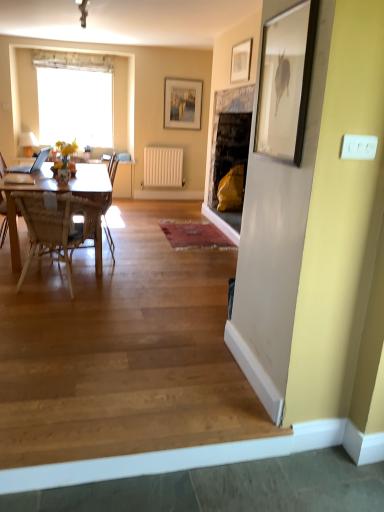
Question: Is matte glass vase at center oriented towards woven wood chair at left, positioned as the 2th chair in back-to-front order?

Choices:
 (A) no
 (B) yes

Answer: (A)

Question: Is matte glass vase at center shorter than woven wood chair at left, positioned as the 2th chair in back-to-front order?

Choices:
 (A) no
 (B) yes

Answer: (B)

Question: From the image's perspective, is matte glass vase at center on top of woven wood chair at left, marked as the 1th chair in a front-to-back arrangement?

Choices:
 (A) yes
 (B) no

Answer: (A)

Question: From a real-world perspective, is matte glass vase at center beneath woven wood chair at left, marked as the 1th chair in a front-to-back arrangement?

Choices:
 (A) yes
 (B) no

Answer: (B)

Question: Is woven wood chair at left, marked as the 1th chair in a front-to-back arrangement, at the back of matte glass vase at center?

Choices:
 (A) no
 (B) yes

Answer: (A)

Question: Is point (119, 205) closer or farther from the camera than point (112, 157)?

Choices:
 (A) closer
 (B) farther

Answer: (A)

Question: Is wooden at lower left situated inside wooden chair at left, which appears as the 1th chair when viewed from the back, or outside?

Choices:
 (A) inside
 (B) outside

Answer: (B)

Question: In terms of height, does wooden at lower left look taller or shorter compared to wooden chair at left, which is the second chair in front-to-back order?

Choices:
 (A) tall
 (B) short

Answer: (B)

Question: Visually, is wooden at lower left positioned to the left or to the right of wooden chair at left, which appears as the 1th chair when viewed from the back?

Choices:
 (A) right
 (B) left

Answer: (A)

Question: Would you say woven wood chair at left, positioned as the 2th chair in back-to-front order, is to the left or to the right of white matte radiator at center in the picture?

Choices:
 (A) right
 (B) left

Answer: (B)

Question: Do you think woven wood chair at left, positioned as the 2th chair in back-to-front order, is within white matte radiator at center, or outside of it?

Choices:
 (A) inside
 (B) outside

Answer: (B)

Question: Does point (26, 193) appear closer or farther from the camera than point (165, 153)?

Choices:
 (A) closer
 (B) farther

Answer: (A)

Question: Relative to white matte radiator at center, is woven wood chair at left, marked as the 1th chair in a front-to-back arrangement, in front or behind?

Choices:
 (A) front
 (B) behind

Answer: (A)

Question: From a real-world perspective, is white matte radiator at center physically located above or below matte glass vase at center?

Choices:
 (A) below
 (B) above

Answer: (A)

Question: Is white matte radiator at center wider or thinner than matte glass vase at center?

Choices:
 (A) thin
 (B) wide

Answer: (A)